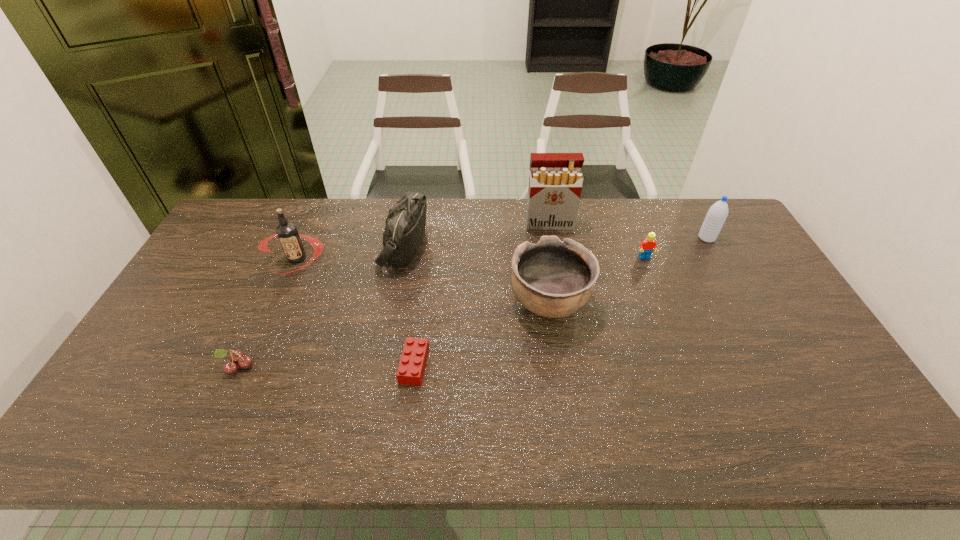
Locate an element on the screen. The height and width of the screenshot is (540, 960). free space in the image that satisfies the following two spatial constraints: 1. on the label of the root beer; 2. on the left side of the shorter Lego is located at coordinates (251, 365).

The width and height of the screenshot is (960, 540). Identify the location of free spot that satisfies the following two spatial constraints: 1. at the front padded panel of the pottery; 2. on the left side of the shoulder bag. (394, 302).

I want to click on vacant point that satisfies the following two spatial constraints: 1. with the lid open on the cigarette case; 2. at the front padded panel of the shoulder bag, so click(553, 246).